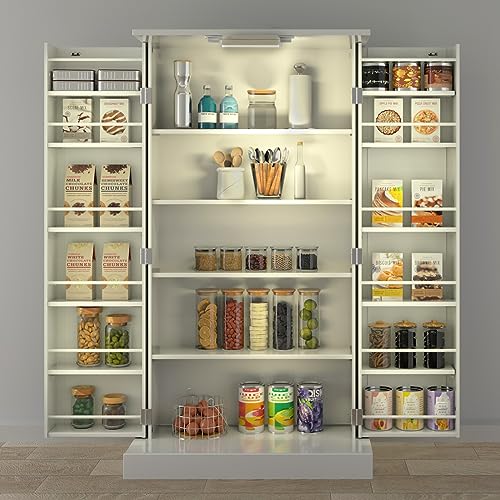
What are the coordinates of `metal spoons` in the screenshot? It's located at (254, 156), (260, 155), (270, 156), (278, 155), (286, 154).